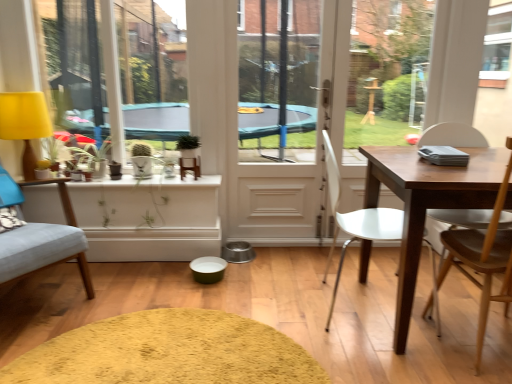
Identify the location of free space that is in between white plastic chair at center, positioned as the second chair in left-to-right order, and soft yellow rug at center. This screenshot has height=384, width=512. (259, 306).